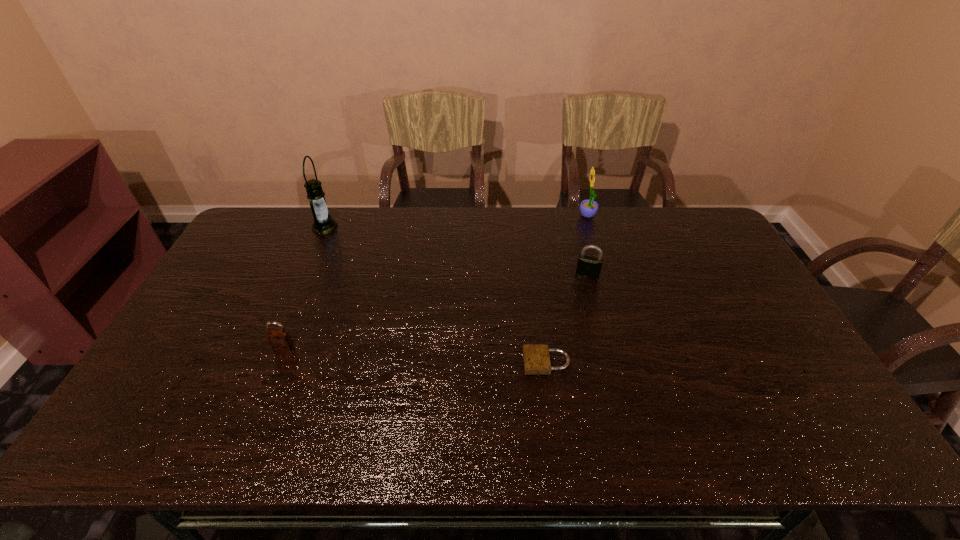
You are a GUI agent. You are given a task and a screenshot of the screen. Output one action in this format:
    pyautogui.click(x=<x>, y=<y>)
    Task: Click on the lantern
    The width and height of the screenshot is (960, 540).
    Given the screenshot: What is the action you would take?
    pyautogui.click(x=323, y=223)

Where is `sunflower`? sunflower is located at coordinates (588, 208).

Identify the location of the third nearest object. The image size is (960, 540). (587, 266).

Locate an element on the screen. This screenshot has height=540, width=960. the rightmost padlock is located at coordinates 587,266.

The image size is (960, 540). I want to click on the leftmost padlock, so click(x=280, y=340).

Find the location of a particular element. This screenshot has height=540, width=960. the shortest padlock is located at coordinates (536, 357).

This screenshot has height=540, width=960. Identify the location of the third object from left to right. (536, 357).

This screenshot has width=960, height=540. Find the location of `free space located on the side where the tallest object emits light`. free space located on the side where the tallest object emits light is located at coordinates (379, 227).

What are the coordinates of `vacant space situated on the front-facing side of the sunflower` in the screenshot? It's located at pos(474,217).

Find the location of a particular element. The width and height of the screenshot is (960, 540). vacant area situated 0.250m on the front-facing side of the sunflower is located at coordinates (512, 217).